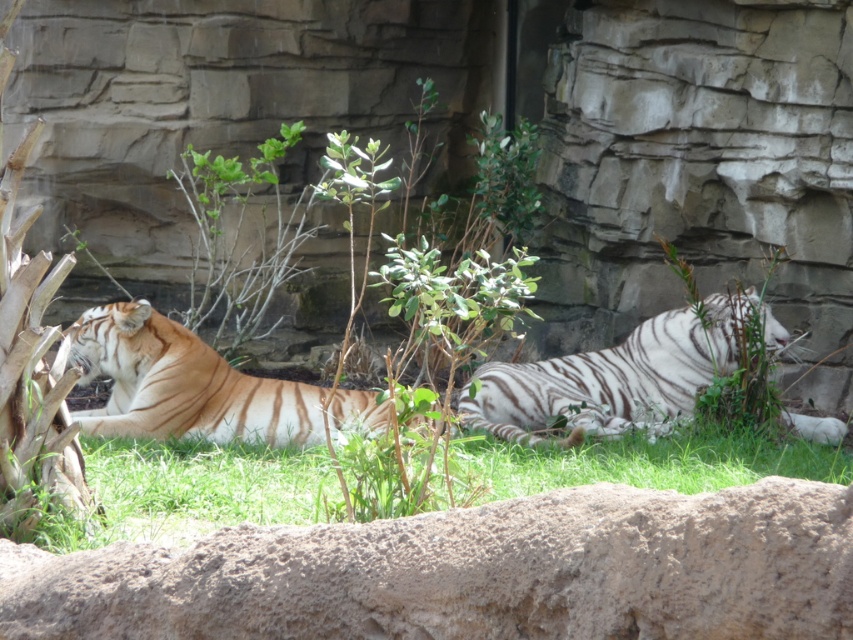
Question: Is green grass at center positioned behind white striped tiger at center?

Choices:
 (A) no
 (B) yes

Answer: (A)

Question: Considering the real-world distances, which object is closest to the green grass at center?

Choices:
 (A) orange fur tiger at left
 (B) white striped tiger at center

Answer: (A)

Question: Which object is the farthest from the green grass at center?

Choices:
 (A) white striped tiger at center
 (B) orange fur tiger at left

Answer: (A)

Question: Does green grass at center have a lesser width compared to white striped tiger at center?

Choices:
 (A) no
 (B) yes

Answer: (B)

Question: Which point is closer to the camera?

Choices:
 (A) (757, 448)
 (B) (607, 384)

Answer: (A)

Question: Is green grass at center further to camera compared to orange fur tiger at left?

Choices:
 (A) yes
 (B) no

Answer: (B)